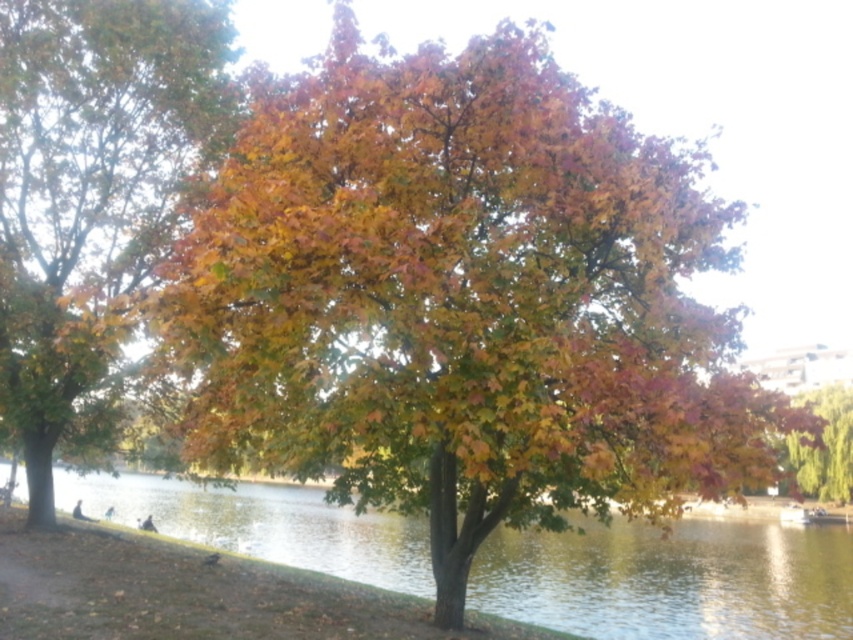
Which is more to the left, multicolored leaves at center or autumn leaves tree at right?

multicolored leaves at center

Can you confirm if multicolored leaves at center is bigger than autumn leaves tree at right?

Actually, multicolored leaves at center might be smaller than autumn leaves tree at right.

Image resolution: width=853 pixels, height=640 pixels. I want to click on multicolored leaves at center, so click(x=88, y=195).

I want to click on multicolored leaves at center, so click(88, 195).

Is multicolored leaves at center above clear water at center?

Indeed, multicolored leaves at center is positioned over clear water at center.

Is point (48, 472) positioned behind point (299, 515)?

No, it is in front of (299, 515).

Where is `multicolored leaves at center`? Image resolution: width=853 pixels, height=640 pixels. multicolored leaves at center is located at coordinates (88, 195).

Between clear water at center and autumn leaves tree at right, which one has more height?

autumn leaves tree at right

Which is more to the left, clear water at center or autumn leaves tree at right?

clear water at center

Which is in front, point (844, 637) or point (822, 413)?

Positioned in front is point (844, 637).

I want to click on clear water at center, so click(672, 579).